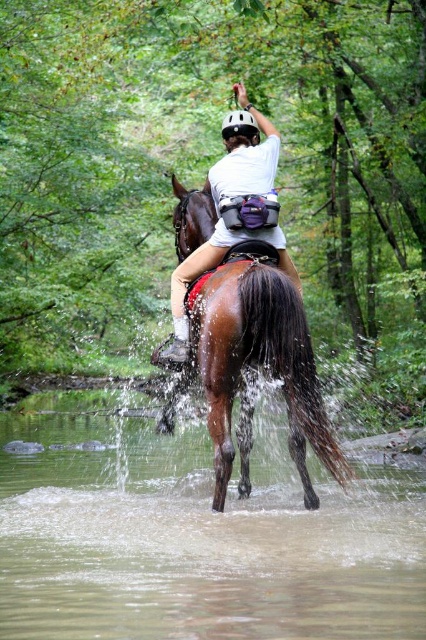
At what (x,y) coordinates should I click in order to perform the action: click on brown glossy horse at center. Please return your answer as a coordinate pair (x, y). The width and height of the screenshot is (426, 640). Looking at the image, I should click on tap(253, 364).

At what (x,y) coordinates should I click in order to perform the action: click on brown glossy horse at center. Please return your answer as a coordinate pair (x, y). Looking at the image, I should click on (253, 364).

I want to click on brown glossy horse at center, so click(x=253, y=364).

Between brown glossy water at lower center and white matte helmet at upper center, which one is positioned lower?

brown glossy water at lower center is lower down.

Does point (313, 532) come farther from viewer compared to point (175, 280)?

That is False.

Does point (57, 534) come in front of point (253, 170)?

Yes, it is.

Locate an element on the screen. The height and width of the screenshot is (640, 426). brown glossy water at lower center is located at coordinates (198, 538).

Does brown glossy water at lower center lie in front of brown glossy horse at center?

That is True.

Who is positioned more to the right, brown glossy water at lower center or brown glossy horse at center?

From the viewer's perspective, brown glossy horse at center appears more on the right side.

Is point (340, 602) positioned in front of point (244, 300)?

Yes, point (340, 602) is closer to viewer.

What are the coordinates of `brown glossy water at lower center` in the screenshot? It's located at (198, 538).